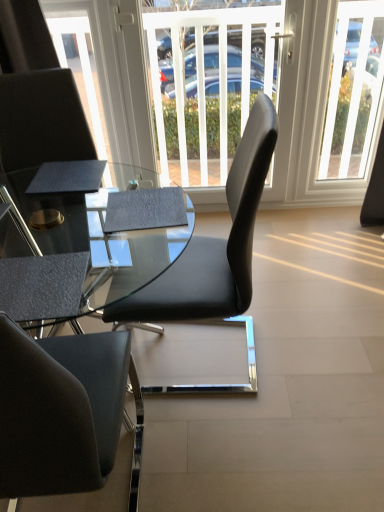
What is the approximate width of white matte door at center?

It is 4.91 inches.

Describe the element at coordinates (353, 89) in the screenshot. I see `clear glass door at upper center` at that location.

This screenshot has height=512, width=384. Find the location of `clear glass door at upper center`. clear glass door at upper center is located at coordinates (353, 89).

The image size is (384, 512). What do you see at coordinates (214, 255) in the screenshot?
I see `black leather chair at center, the 1th chair viewed from the right` at bounding box center [214, 255].

I want to click on black leather chair at center, which is the 2th chair from left to right, so click(214, 255).

Where is `matte black glass table at center`? The height and width of the screenshot is (512, 384). matte black glass table at center is located at coordinates (73, 254).

Does clear glass door at upper center touch black leather chair at left, which ranks as the 1th chair in left-to-right order?

No, clear glass door at upper center is not making contact with black leather chair at left, which ranks as the 1th chair in left-to-right order.

Locate an element on the screen. This screenshot has height=512, width=384. chair that is the 1st object directly below the clear glass door at upper center (from a real-world perspective) is located at coordinates coord(42,120).

Is clear glass door at upper center positioned before black leather chair at left, which ranks as the 1th chair in left-to-right order?

No, the depth of clear glass door at upper center is greater than that of black leather chair at left, which ranks as the 1th chair in left-to-right order.

Is the depth of white matte door at center greater than that of black leather chair at center, the 1th chair viewed from the right?

Yes, the depth of white matte door at center is greater than that of black leather chair at center, the 1th chair viewed from the right.

Considering the relative sizes of white matte door at center and black leather chair at center, the 1th chair viewed from the right, in the image provided, is white matte door at center smaller than black leather chair at center, the 1th chair viewed from the right,?

Indeed, white matte door at center has a smaller size compared to black leather chair at center, the 1th chair viewed from the right.

Can you confirm if white matte door at center is positioned to the right of black leather chair at center, the 1th chair viewed from the right?

Correct, you'll find white matte door at center to the right of black leather chair at center, the 1th chair viewed from the right.

Looking at this image, can you tell me how much matte black glass table at center and white matte door at center differ in facing direction?

94.8 degrees separate the facing orientations of matte black glass table at center and white matte door at center.

Is white matte door at center at the back of matte black glass table at center?

No, white matte door at center is not at the back of matte black glass table at center.

Measure the distance from matte black glass table at center to white matte door at center.

matte black glass table at center is 1.26 meters away from white matte door at center.

From the image's perspective, which one is positioned higher, matte black glass table at center or white matte door at center?

white matte door at center.

Is textured black armchair at lower left at the back of clear glass door at upper center?

clear glass door at upper center is not turned away from textured black armchair at lower left.

Which is closer to the camera, (327, 124) or (37, 276)?

The point (37, 276) is in front.

Does clear glass door at upper center have a larger size compared to textured black armchair at lower left?

Yes.

Choose the correct answer: Is clear glass door at upper center inside textured black armchair at lower left or outside it?

clear glass door at upper center lies outside textured black armchair at lower left.

Where is `window above the white matte door at center (from a real-world perspective)`? The width and height of the screenshot is (384, 512). window above the white matte door at center (from a real-world perspective) is located at coordinates (353, 89).

Which of these two, clear glass door at upper center or white matte door at center, stands taller?

Standing taller between the two is white matte door at center.

Would you say clear glass door at upper center is to the left or to the right of white matte door at center in the picture?

From the image, it's evident that clear glass door at upper center is to the right of white matte door at center.

Which is more to the left, white matte door at center or textured black armchair at lower left?

Positioned to the left is textured black armchair at lower left.

Is white matte door at center not close to textured black armchair at lower left?

Indeed, white matte door at center is not near textured black armchair at lower left.

Can you confirm if white matte door at center is bigger than textured black armchair at lower left?

Yes.

Could you tell me if white matte door at center is facing textured black armchair at lower left?

Yes, white matte door at center is facing textured black armchair at lower left.

Which is more to the left, textured black armchair at lower left or black leather chair at left, placed as the 2th chair when sorted from right to left?

black leather chair at left, placed as the 2th chair when sorted from right to left, is more to the left.

Which point is more forward, (57, 295) or (79, 146)?

The point (57, 295) is closer to the camera.

Is textured black armchair at lower left directly adjacent to black leather chair at left, which ranks as the 1th chair in left-to-right order?

textured black armchair at lower left and black leather chair at left, which ranks as the 1th chair in left-to-right order, are not in contact.

From the image's perspective, is textured black armchair at lower left located above black leather chair at left, which ranks as the 1th chair in left-to-right order?

No, from the image's perspective, textured black armchair at lower left is not above black leather chair at left, which ranks as the 1th chair in left-to-right order.

At what (x,y) coordinates should I click in order to perform the action: click on window lying behind the black leather chair at left, placed as the 2th chair when sorted from right to left. Please return your answer as a coordinate pair (x, y). The height and width of the screenshot is (512, 384). Looking at the image, I should click on (353, 89).

Locate an element on the screen. window screen above the black leather chair at center, which is the 2th chair from left to right (from the image's perspective) is located at coordinates (276, 99).

Which object lies further to the anchor point black leather chair at center, the 1th chair viewed from the right, white matte door at center or clear glass door at upper center?

clear glass door at upper center is positioned further to the anchor black leather chair at center, the 1th chair viewed from the right.

Estimate the real-world distances between objects in this image. Which object is further from black leather chair at center, which is the 2th chair from left to right, black leather chair at left, which ranks as the 1th chair in left-to-right order, or clear glass door at upper center?

clear glass door at upper center is positioned further to the anchor black leather chair at center, which is the 2th chair from left to right.

From the image, which object appears to be nearer to white matte door at center, black leather chair at left, which ranks as the 1th chair in left-to-right order, or textured black armchair at lower left?

black leather chair at left, which ranks as the 1th chair in left-to-right order.

Based on their spatial positions, is black leather chair at left, which ranks as the 1th chair in left-to-right order, or white matte door at center closer to matte black glass table at center?

black leather chair at left, which ranks as the 1th chair in left-to-right order, is closer to matte black glass table at center.

Which object lies further to the anchor point black leather chair at center, the 1th chair viewed from the right, clear glass door at upper center or matte black glass table at center?

clear glass door at upper center is further to black leather chair at center, the 1th chair viewed from the right.

From the image, which object appears to be nearer to matte black glass table at center, textured black armchair at lower left or black leather chair at center, the 1th chair viewed from the right?

textured black armchair at lower left lies closer to matte black glass table at center than the other object.

From the image, which object appears to be nearer to matte black glass table at center, clear glass door at upper center or white matte door at center?

white matte door at center lies closer to matte black glass table at center than the other object.

Which object lies nearer to the anchor point textured black armchair at lower left, black leather chair at left, placed as the 2th chair when sorted from right to left, or matte black glass table at center?

matte black glass table at center.

Find the location of a particular element. The width and height of the screenshot is (384, 512). armchair situated between black leather chair at left, placed as the 2th chair when sorted from right to left, and clear glass door at upper center from left to right is located at coordinates (40, 278).

Where is `window screen between textured black armchair at lower left and clear glass door at upper center from left to right`? window screen between textured black armchair at lower left and clear glass door at upper center from left to right is located at coordinates (276, 99).

Identify the location of armchair that lies between black leather chair at left, placed as the 2th chair when sorted from right to left, and matte black glass table at center from top to bottom. (40, 278).

At what (x,y) coordinates should I click in order to perform the action: click on window screen between black leather chair at left, placed as the 2th chair when sorted from right to left, and clear glass door at upper center. Please return your answer as a coordinate pair (x, y). The height and width of the screenshot is (512, 384). Looking at the image, I should click on (276, 99).